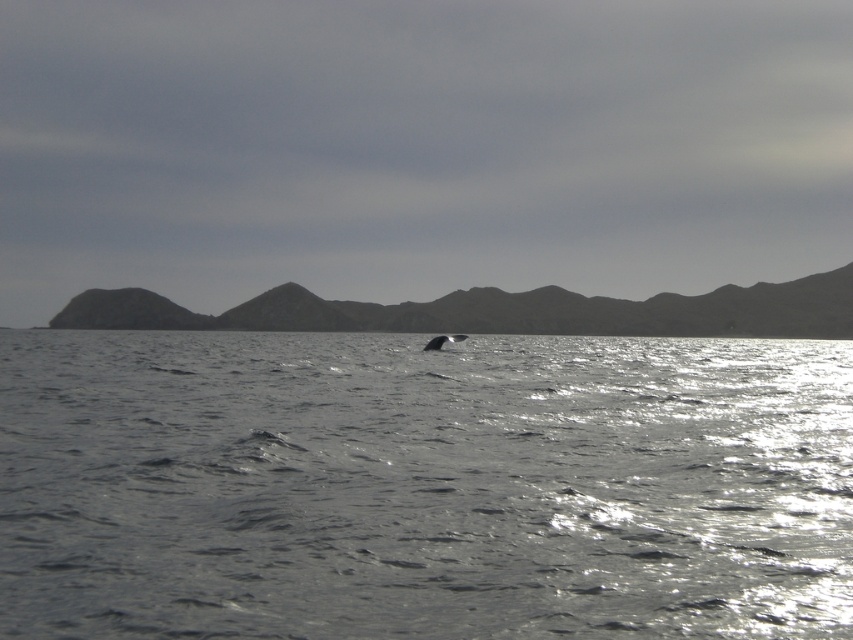
Which is in front, point (509, 524) or point (463, 304)?

Positioned in front is point (509, 524).

Which is in front, point (35, 634) or point (90, 294)?

Point (35, 634) is in front.

What are the coordinates of `glistening silver water at center` in the screenshot? It's located at (422, 486).

Does glistening silver water at center lie behind gray matte whale at center?

No.

Does glistening silver water at center have a greater width compared to gray matte whale at center?

Yes.

Who is more forward, [705,483] or [459,337]?

Point [705,483] is in front.

I want to click on glistening silver water at center, so click(x=422, y=486).

Who is shorter, gray rocky mountain at center or gray matte whale at center?

gray matte whale at center

Which is behind, point (643, 326) or point (448, 340)?

The point (643, 326) is behind.

Is point (583, 296) less distant than point (461, 340)?

No, (583, 296) is behind (461, 340).

This screenshot has width=853, height=640. Find the location of `gray rocky mountain at center`. gray rocky mountain at center is located at coordinates coord(502,310).